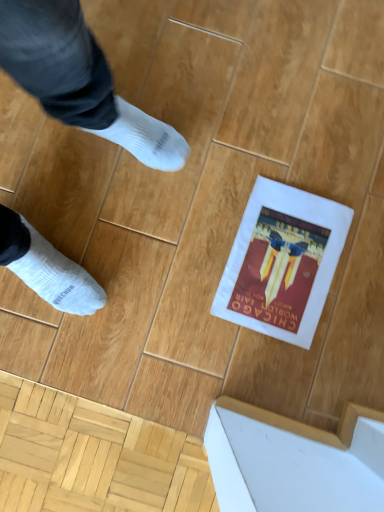
This screenshot has height=512, width=384. In order to click on free point above white matte book cover at center (from a real-world perspective) in this screenshot , I will do (286, 261).